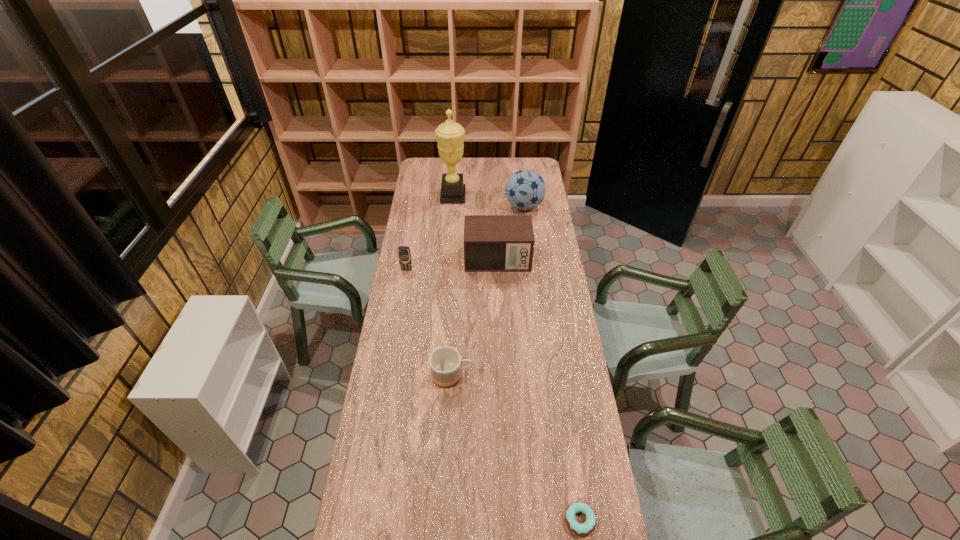
Where is `vacant region that satisfies the following two spatial constraints: 1. on the side with brand of the nearest object; 2. on the left side of the soccer ball`? The image size is (960, 540). vacant region that satisfies the following two spatial constraints: 1. on the side with brand of the nearest object; 2. on the left side of the soccer ball is located at coordinates (562, 520).

You are a GUI agent. You are given a task and a screenshot of the screen. Output one action in this format:
    pyautogui.click(x=<x>, y=<y>)
    Task: Click on the vacant area that satisfies the following two spatial constraints: 1. on the front-facing side of the radio receiver; 2. on the side with the handle of the mug
    This screenshot has height=540, width=960.
    Given the screenshot: What is the action you would take?
    pyautogui.click(x=502, y=376)

You are a GUI agent. You are given a task and a screenshot of the screen. Output one action in this format:
    pyautogui.click(x=<x>, y=<y>)
    Task: Click on the vacant space that satisfies the following two spatial constraints: 1. on the side with brand of the soccer ball; 2. on the right side of the nearest object
    Image resolution: width=960 pixels, height=540 pixels.
    Given the screenshot: What is the action you would take?
    pyautogui.click(x=562, y=520)

The height and width of the screenshot is (540, 960). Identify the location of free region that satisfies the following two spatial constraints: 1. on the side with brand of the soccer ball; 2. on the side with the handle of the second nearest object. (544, 376).